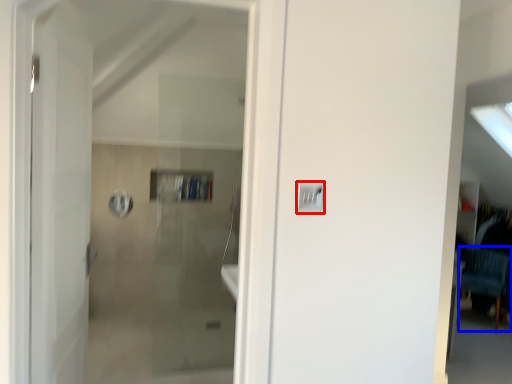
Question: Which of the following is the closest to the observer, light switch (highlighted by a red box) or furniture (highlighted by a blue box)?

Choices:
 (A) light switch
 (B) furniture

Answer: (A)